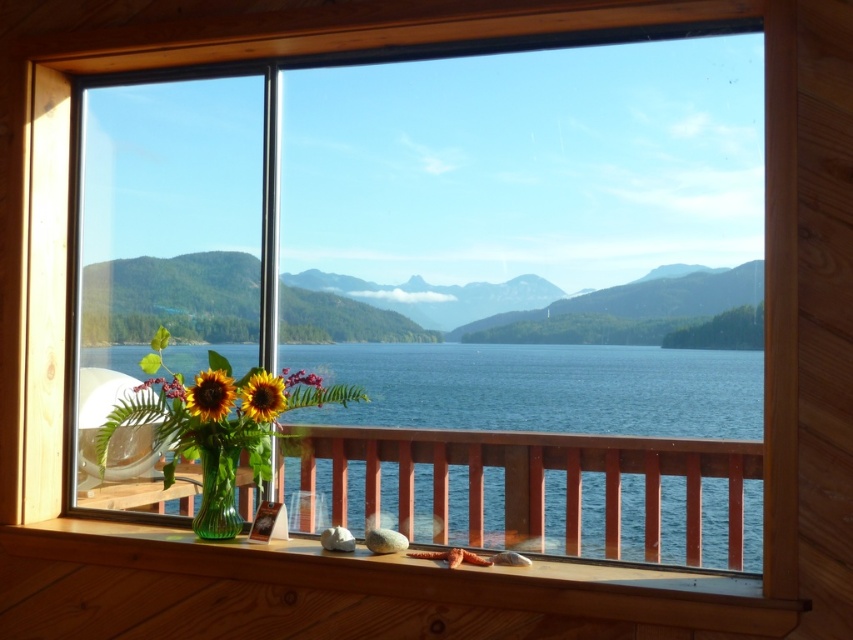
You are standing in the room and want to place a 10 feet long wooden bench between the matte glass sunflower at center and the wooden interior wall visible at. Will the bench fit in the space between them?

The space between the matte glass sunflower at center and the wooden interior wall visible at is only 7.96 feet, which is shorter than the 10 feet long wooden bench. Therefore, the bench will not fit in that space.

What are the coordinates of the matte glass sunflower at center?

The matte glass sunflower at center is located at coordinates point (212,396).

You are standing in the room looking through the window. There are two points marked on the window sill, one at coordinate point (x=193, y=416) and another at point (x=248, y=378). Which point is closer to you?

Point (x=193, y=416) is in front of point (x=248, y=378), so the point at (x=193, y=416) is closer to you.